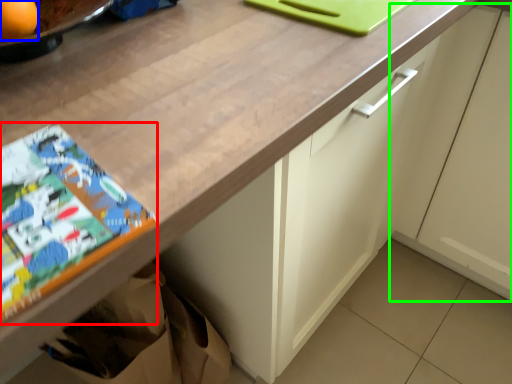
Question: Which object is the closest to the comic book (highlighted by a red box)? Choose among these: orange (highlighted by a blue box) or cabinetry (highlighted by a green box).

Choices:
 (A) orange
 (B) cabinetry

Answer: (A)